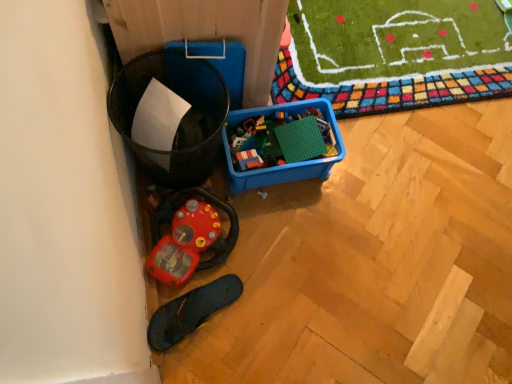
Question: Would you say black rubber slipper at lower left is part of rubberized plastic toy at lower left, arranged as the 1th toy when viewed from the left,'s contents?

Choices:
 (A) yes
 (B) no

Answer: (B)

Question: Are rubberized plastic toy at lower left, which ranks as the second toy in top-to-bottom order, and black rubber slipper at lower left located far from each other?

Choices:
 (A) no
 (B) yes

Answer: (A)

Question: Is rubberized plastic toy at lower left, placed as the 1th toy when sorted from bottom to top, not within black rubber slipper at lower left?

Choices:
 (A) no
 (B) yes

Answer: (B)

Question: Is rubberized plastic toy at lower left, placed as the 1th toy when sorted from bottom to top, bigger than black rubber slipper at lower left?

Choices:
 (A) yes
 (B) no

Answer: (A)

Question: From a real-world perspective, is rubberized plastic toy at lower left, which ranks as the second toy in top-to-bottom order, positioned over black rubber slipper at lower left based on gravity?

Choices:
 (A) no
 (B) yes

Answer: (B)

Question: Is rubberized plastic toy at lower left, placed as the 1th toy when sorted from bottom to top, oriented towards black rubber slipper at lower left?

Choices:
 (A) no
 (B) yes

Answer: (A)

Question: From a real-world perspective, is green matte building blocks at center, acting as the 1th toy starting from the right, located higher than rubberized plastic toy at lower left, arranged as the 1th toy when viewed from the left?

Choices:
 (A) no
 (B) yes

Answer: (B)

Question: Is green matte building blocks at center, acting as the 1th toy starting from the right, shorter than rubberized plastic toy at lower left, which ranks as the second toy in top-to-bottom order?

Choices:
 (A) no
 (B) yes

Answer: (B)

Question: From the image's perspective, is green matte building blocks at center, which ranks as the 2th toy in left-to-right order, over rubberized plastic toy at lower left, arranged as the 1th toy when viewed from the left?

Choices:
 (A) yes
 (B) no

Answer: (A)

Question: Would you say green matte building blocks at center, which ranks as the 2th toy in bottom-to-top order, contains rubberized plastic toy at lower left, arranged as the 1th toy when viewed from the left?

Choices:
 (A) no
 (B) yes

Answer: (A)

Question: Is green matte building blocks at center, acting as the 1th toy starting from the right, positioned before rubberized plastic toy at lower left, which is the 2th toy from right to left?

Choices:
 (A) yes
 (B) no

Answer: (B)

Question: Is green matte building blocks at center, which is the first toy in top-to-bottom order, aimed at rubberized plastic toy at lower left, arranged as the 1th toy when viewed from the left?

Choices:
 (A) no
 (B) yes

Answer: (A)

Question: Does rubberized plastic toy at lower left, arranged as the 1th toy when viewed from the left, lie behind green matte building blocks at center, which ranks as the 2th toy in left-to-right order?

Choices:
 (A) yes
 (B) no

Answer: (B)